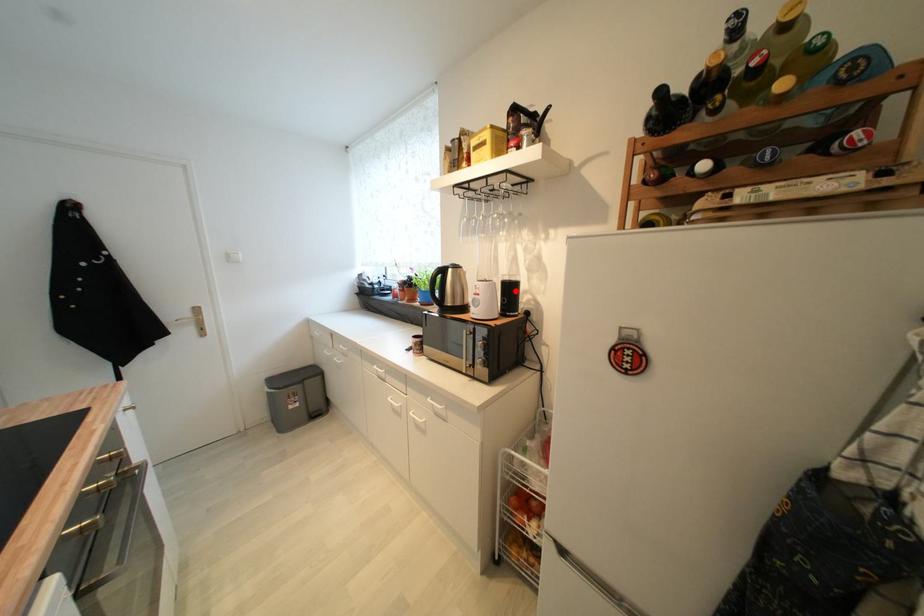
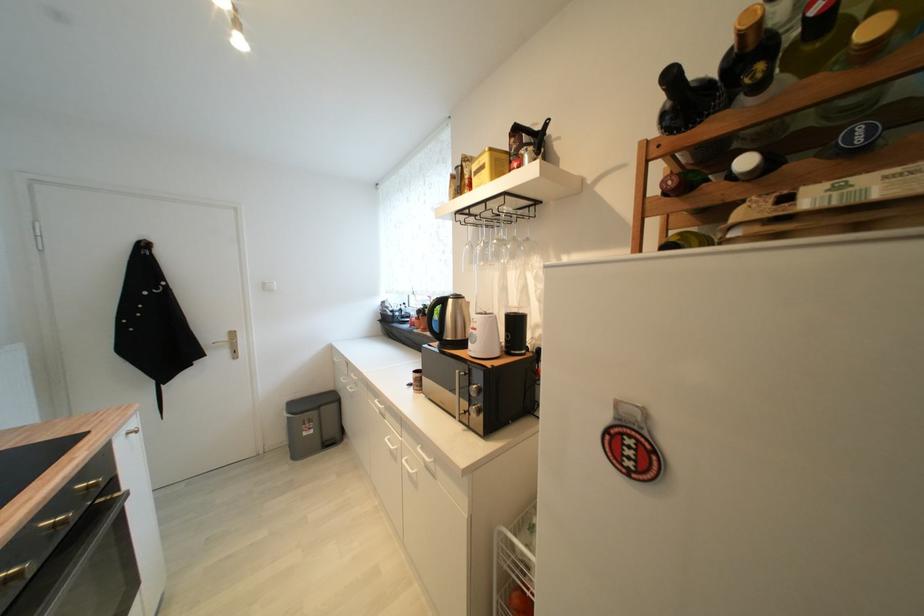
The point at the highlighted location is marked in the first image. Where is the corresponding point in the second image?

(521, 325)